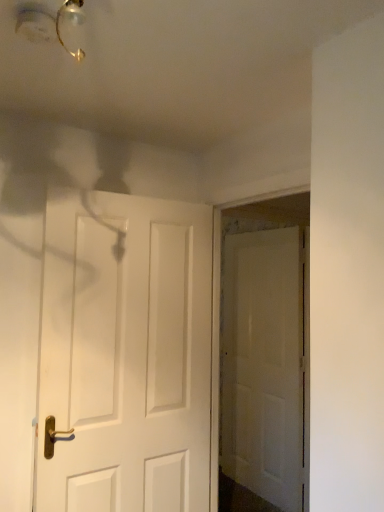
Question: Is white matte door at center, arranged as the 2th door when viewed from the left, in front of or behind white matte door at center, marked as the first door in a front-to-back arrangement, in the image?

Choices:
 (A) front
 (B) behind

Answer: (B)

Question: Is white matte door at center, the 2th door from the front, inside the boundaries of white matte door at center, the second door positioned from the back, or outside?

Choices:
 (A) inside
 (B) outside

Answer: (B)

Question: Considering the real-world distances, which object is closest to the white matte door at center, the 2th door in the right-to-left sequence?

Choices:
 (A) matte gold light fixture at upper left
 (B) white matte door at center, which is the 1th door in right-to-left order

Answer: (A)

Question: Considering the real-world distances, which object is farthest from the white matte door at center, which is the 1th door in right-to-left order?

Choices:
 (A) white matte door at center, marked as the first door in a front-to-back arrangement
 (B) matte gold light fixture at upper left

Answer: (B)